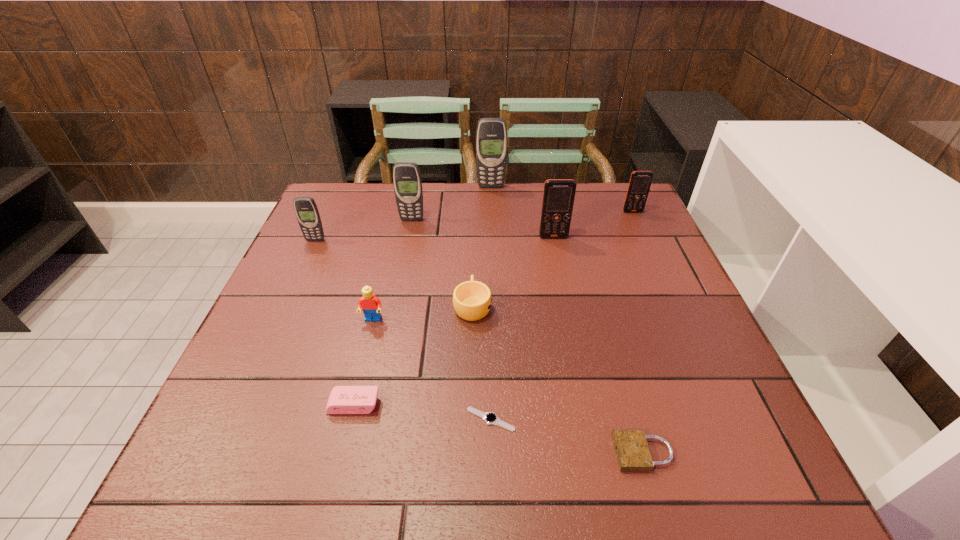
Image resolution: width=960 pixels, height=540 pixels. What are the coordinates of `vacant region between the padlock and the eighth nearest object` in the screenshot? It's located at (527, 336).

Select which object appears as the third closest to the second gray cellular telephone from right to left. Please provide its 2D coordinates. Your answer should be formatted as a tuple, i.e. [(x, y)], where the tuple contains the x and y coordinates of a point satisfying the conditions above.

[(472, 300)]

Identify the location of object that is the eighth closest to the fourth cellular telephone from right to left. The width and height of the screenshot is (960, 540). (490, 418).

Locate an element on the screen. cellular telephone that can be found as the closest to the eighth tallest object is located at coordinates (306, 210).

Select which cellular telephone appears as the closest to the sixth tallest object. Please provide its 2D coordinates. Your answer should be formatted as a tuple, i.e. [(x, y)], where the tuple contains the x and y coordinates of a point satisfying the conditions above.

[(306, 210)]

Point out which gray cellular telephone is positioned as the second nearest to the tallest object. Please provide its 2D coordinates. Your answer should be formatted as a tuple, i.e. [(x, y)], where the tuple contains the x and y coordinates of a point satisfying the conditions above.

[(306, 210)]

Identify the location of gray cellular telephone that stands as the second closest to the farthest object. The width and height of the screenshot is (960, 540). (306, 210).

Identify the location of blank space that satisfies the following two spatial constraints: 1. on the screen of the cup; 2. on the right side of the leftmost gray cellular telephone. (x=286, y=305).

You are a GUI agent. You are given a task and a screenshot of the screen. Output one action in this format:
    pyautogui.click(x=<x>, y=<y>)
    Task: Click on the free region that satisfies the following two spatial constraints: 1. on the screen of the second farthest gray cellular telephone; 2. on the left side of the beige cup
    The image size is (960, 540).
    Given the screenshot: What is the action you would take?
    pyautogui.click(x=395, y=305)